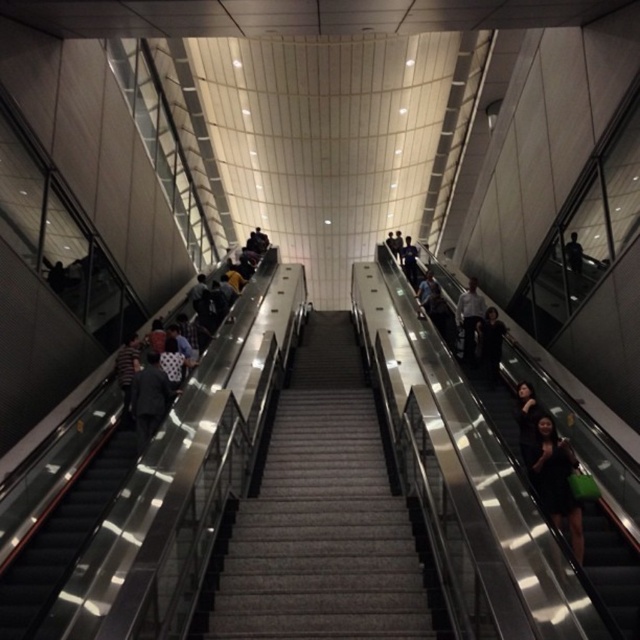
You are standing at the base of the central staircase in the modern indoor setting. You see two points marked on the floor. The first point is at coordinates point (x=244, y=616) and the second is at point (x=124, y=368). If you want to move towards the point that is closer to you, which coordinate should you head towards?

You should head towards point (x=124, y=368) because it is closer to you than point (x=244, y=616).

You are standing at the entrance of the indoor area and notice a white shirt at center. Which direction should you move to reach it?

The white shirt at center is located at point coordinates, so you should move forward towards the center of the area to reach it.

You are standing at the bottom of the stairs in this modern indoor setting. You notice a point marked at coordinates (x=323, y=518). What does this point indicate?

The point at coordinates (x=323, y=518) marks the location of the dark gray carpeted stairs at center.